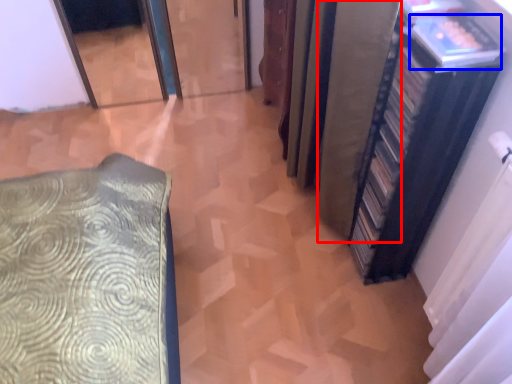
Question: Among these objects, which one is farthest to the camera, curtain (highlighted by a red box) or book (highlighted by a blue box)?

Choices:
 (A) curtain
 (B) book

Answer: (A)